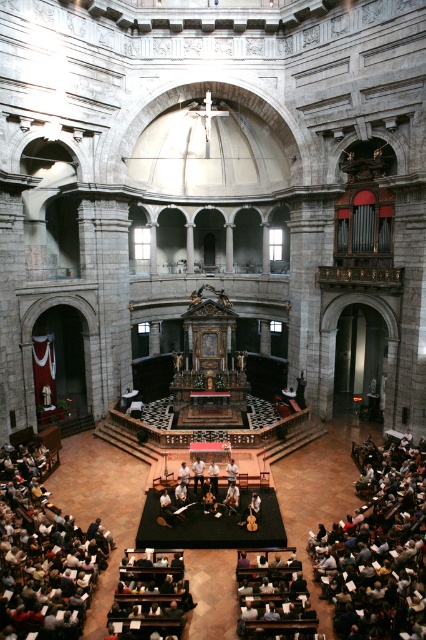
In order to click on light brown leather jacket at center in this screenshot , I will do `click(198, 472)`.

How much distance is there between light brown leather jacket at center and white fabric at center?

light brown leather jacket at center and white fabric at center are 2.06 meters apart from each other.

The height and width of the screenshot is (640, 426). In order to click on light brown leather jacket at center in this screenshot , I will do `click(198, 472)`.

Does dark gray fabric at lower right appear on the right side of light brown leather jacket at center?

Yes, dark gray fabric at lower right is to the right of light brown leather jacket at center.

Is dark gray fabric at lower right below light brown leather jacket at center?

Correct, dark gray fabric at lower right is located below light brown leather jacket at center.

Where is `dark gray fabric at lower right`? The height and width of the screenshot is (640, 426). dark gray fabric at lower right is located at coordinates (379, 548).

Is dark gray fabric at lower right smaller than white fabric at center?

Actually, dark gray fabric at lower right might be larger than white fabric at center.

Describe the element at coordinates (379, 548) in the screenshot. I see `dark gray fabric at lower right` at that location.

Which is in front, point (420, 509) or point (230, 468)?

Point (420, 509) is in front.

Locate an element on the screen. The image size is (426, 640). dark gray fabric at lower right is located at coordinates (379, 548).